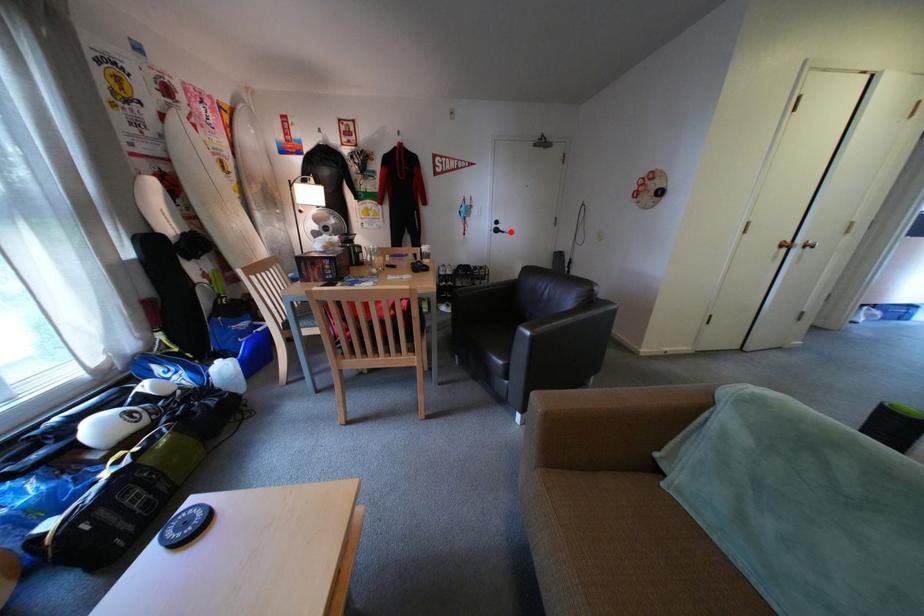
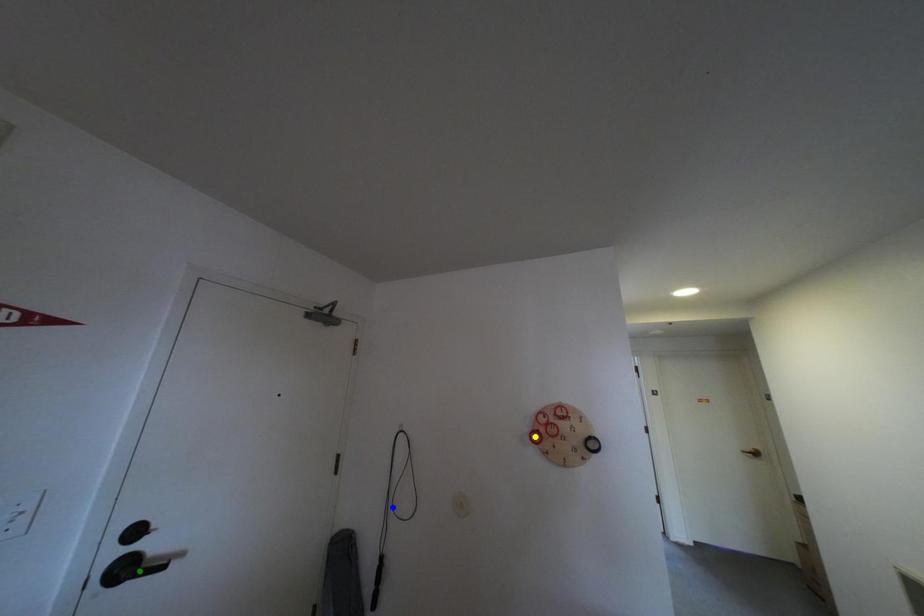
Question: I am providing you with two images of the same scene from different viewpoints. A red point is marked on the first image. You are given multiple points on the second image. Can you choose the point in image 2 that corresponds to the point in image 1?

Choices:
 (A) green point
 (B) yellow point
 (C) blue point

Answer: (A)